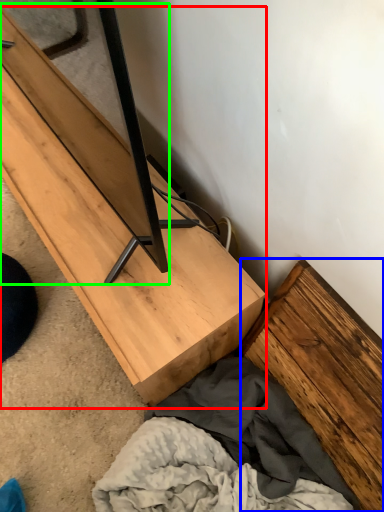
Question: Which object is positioned closest to furniture (highlighted by a red box)? Select from plank (highlighted by a blue box) and plank (highlighted by a green box).

Choices:
 (A) plank
 (B) plank

Answer: (B)